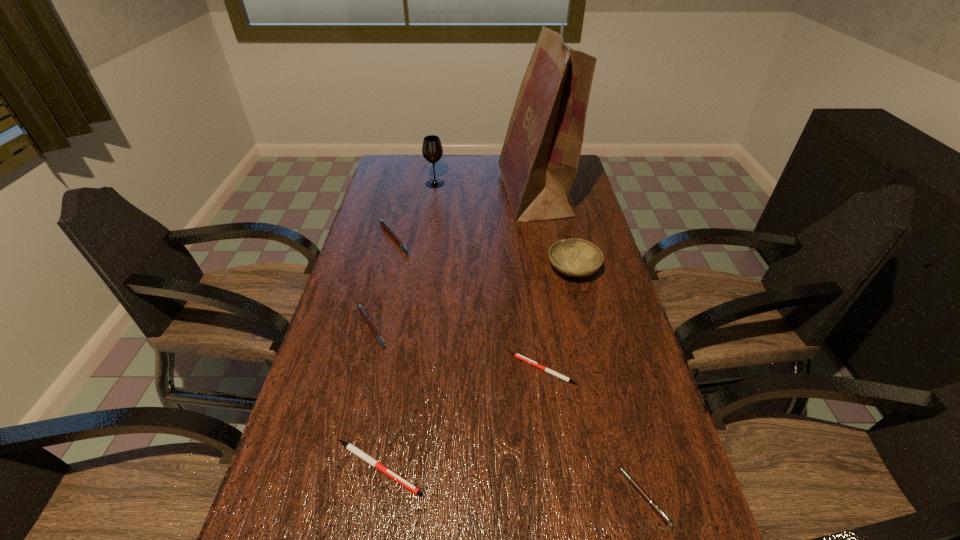
Identify which white pen is located as the second nearest to the gray wineglass. Please provide its 2D coordinates. Your answer should be formatted as a tuple, i.e. [(x, y)], where the tuple contains the x and y coordinates of a point satisfying the conditions above.

[(349, 446)]